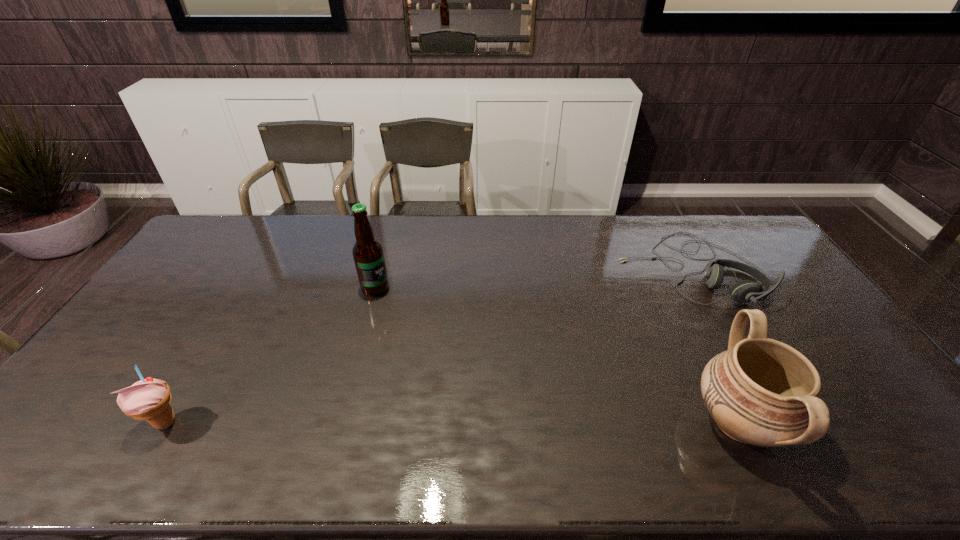
Identify the location of object that is at the far right corner. (745, 291).

The image size is (960, 540). In order to click on vacant space at the far edge of the desktop in this screenshot , I will do `click(317, 246)`.

This screenshot has width=960, height=540. What are the coordinates of `free spot at the near edge of the desktop` in the screenshot? It's located at (699, 399).

You are a GUI agent. You are given a task and a screenshot of the screen. Output one action in this format:
    pyautogui.click(x=<x>, y=<y>)
    Task: Click on the blank space at the left edge of the desktop
    The height and width of the screenshot is (540, 960).
    Given the screenshot: What is the action you would take?
    pyautogui.click(x=202, y=259)

You are a GUI agent. You are given a task and a screenshot of the screen. Output one action in this format:
    pyautogui.click(x=<x>, y=<y>)
    Task: Click on the vacant region at the right edge of the desktop
    
    Given the screenshot: What is the action you would take?
    pyautogui.click(x=829, y=348)

At what (x,y) coordinates should I click in order to perform the action: click on vacant space at the far left corner of the desktop. Please return your answer as a coordinate pair (x, y). Image resolution: width=960 pixels, height=540 pixels. Looking at the image, I should click on (204, 241).

In the image, there is a desktop. Where is `vacant space at the far right corner`? This screenshot has height=540, width=960. vacant space at the far right corner is located at coordinates (739, 251).

Find the location of `vacant region at the near right corner of the desktop`. vacant region at the near right corner of the desktop is located at coordinates (852, 416).

What are the coordinates of `free spot between the urn and the headset` in the screenshot? It's located at (714, 345).

I want to click on free space between the urn and the beer bottle, so click(557, 355).